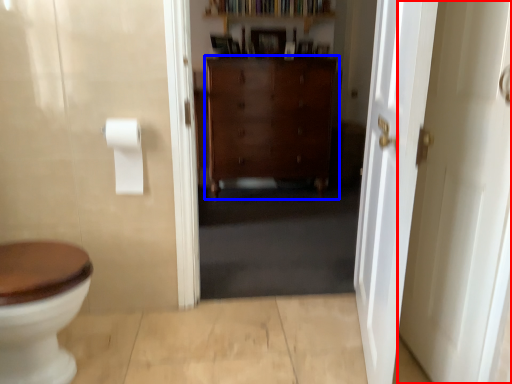
Question: Which point is further to the camera, door (highlighted by a red box) or cabinetry (highlighted by a blue box)?

Choices:
 (A) door
 (B) cabinetry

Answer: (B)